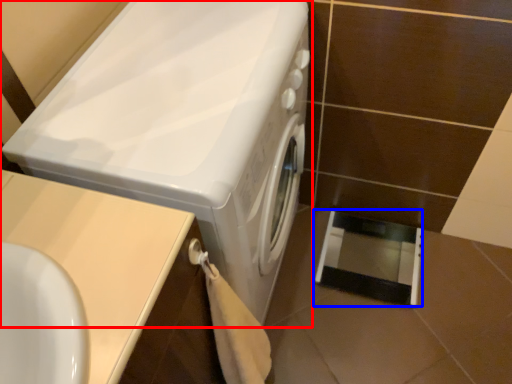
Question: Which of the following is the closest to the observer, washing machine (highlighted by a red box) or screen door (highlighted by a blue box)?

Choices:
 (A) washing machine
 (B) screen door

Answer: (A)